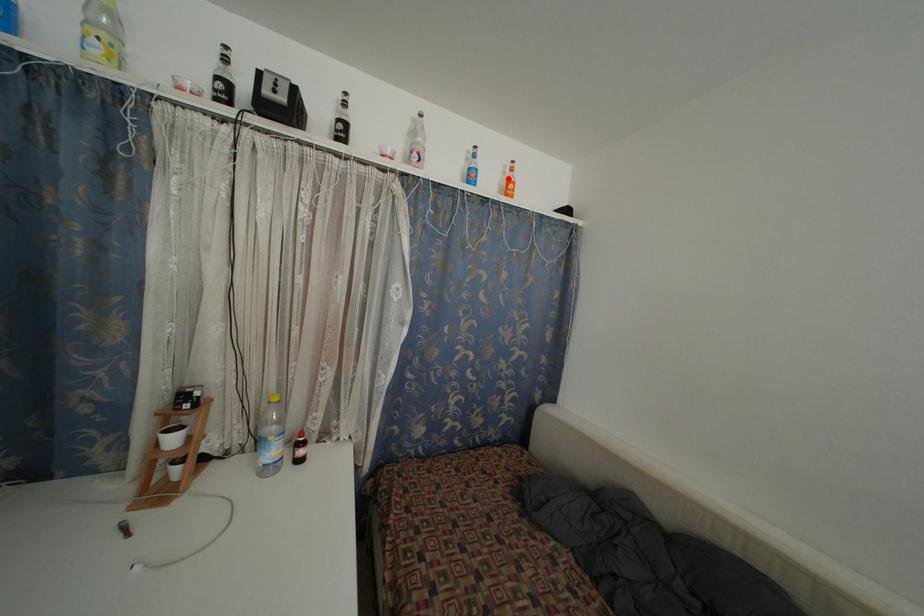
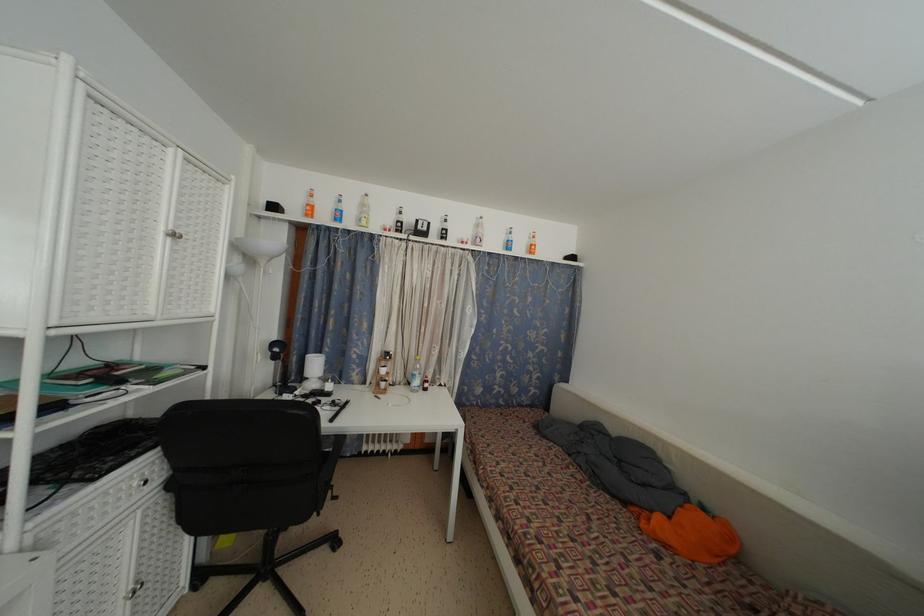
Find the pixel in the second image that matches the highlighted location in the first image.

(533, 244)